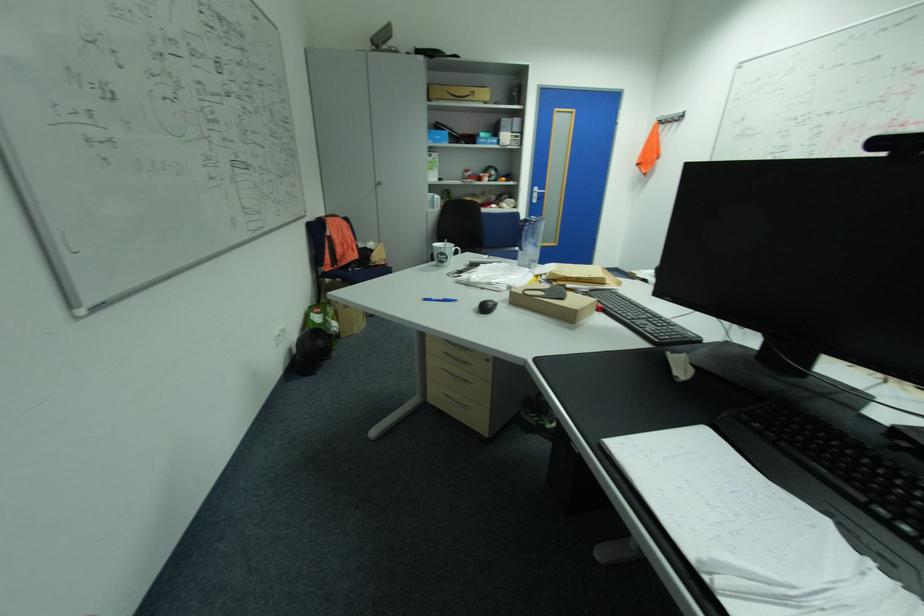
You are a GUI agent. You are given a task and a screenshot of the screen. Output one action in this format:
    pyautogui.click(x=<x>, y=<y>)
    Task: Click on the printed white mug
    The image size is (924, 616).
    Given the screenshot: What is the action you would take?
    pyautogui.click(x=444, y=253)